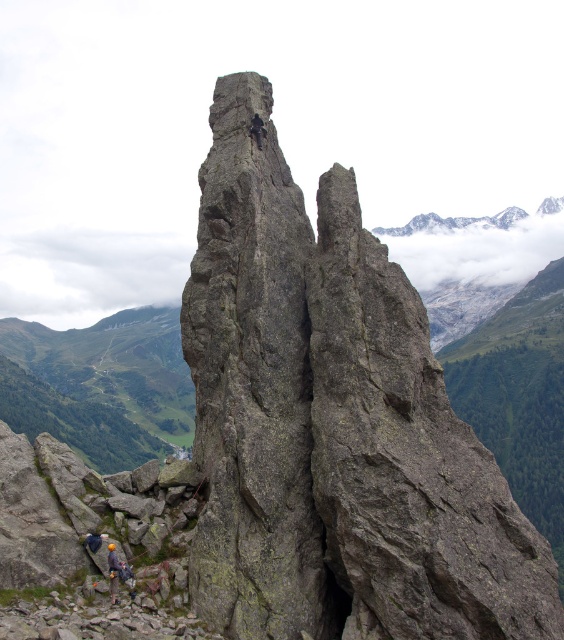
Who is more distant from viewer, (x=253, y=595) or (x=125, y=573)?

The point (x=125, y=573) is behind.

This screenshot has height=640, width=564. Identify the location of gray rough rock at center. (333, 422).

This screenshot has height=640, width=564. In order to click on gray rough rock at center in this screenshot , I will do `click(333, 422)`.